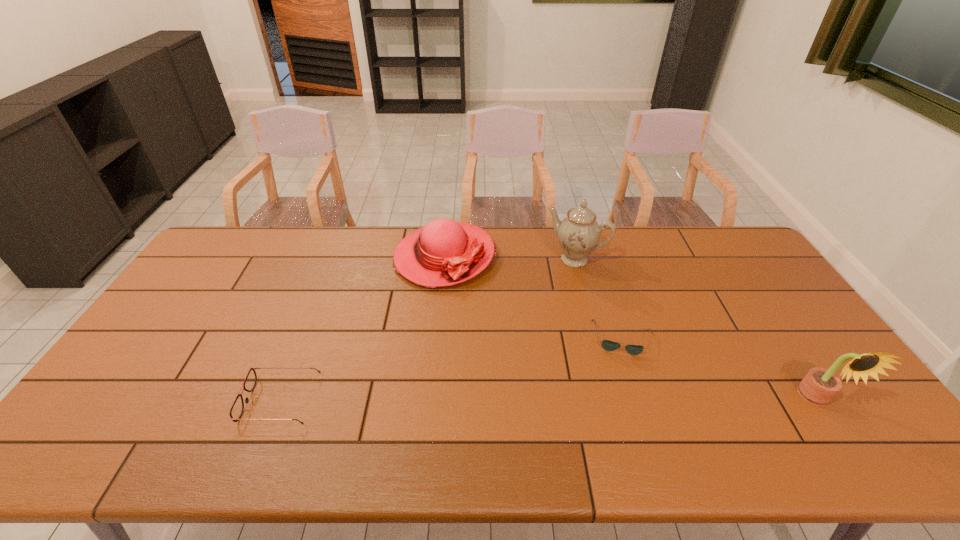
Where is `the left sunglasses`? the left sunglasses is located at coordinates (237, 408).

Locate an element on the screen. the second shortest object is located at coordinates (237, 408).

Locate an element on the screen. This screenshot has height=540, width=960. the rightmost object is located at coordinates (819, 386).

This screenshot has width=960, height=540. I want to click on chinaware, so click(578, 234).

This screenshot has height=540, width=960. Find the location of `the third shortest object`. the third shortest object is located at coordinates (444, 252).

The width and height of the screenshot is (960, 540). In order to click on hat in this screenshot , I will do `click(444, 252)`.

I want to click on the shorter sunglasses, so click(607, 345).

Find the location of a particular element. The width and height of the screenshot is (960, 540). the right sunglasses is located at coordinates (607, 345).

Find the location of a particular element. The image size is (960, 540). free location located 0.160m on the front-facing side of the left sunglasses is located at coordinates (183, 401).

Find the location of a particular element. vacant space located on the front-facing side of the left sunglasses is located at coordinates (120, 401).